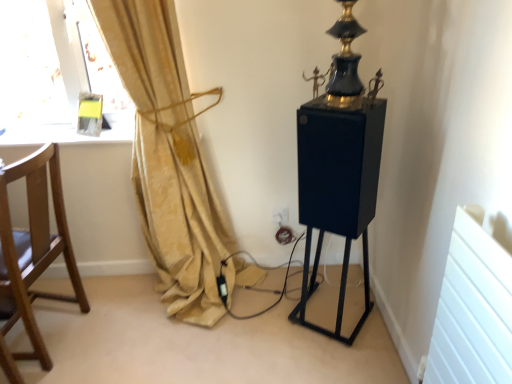
Identify the location of free space in front of gold fabric curtain at left. (180, 358).